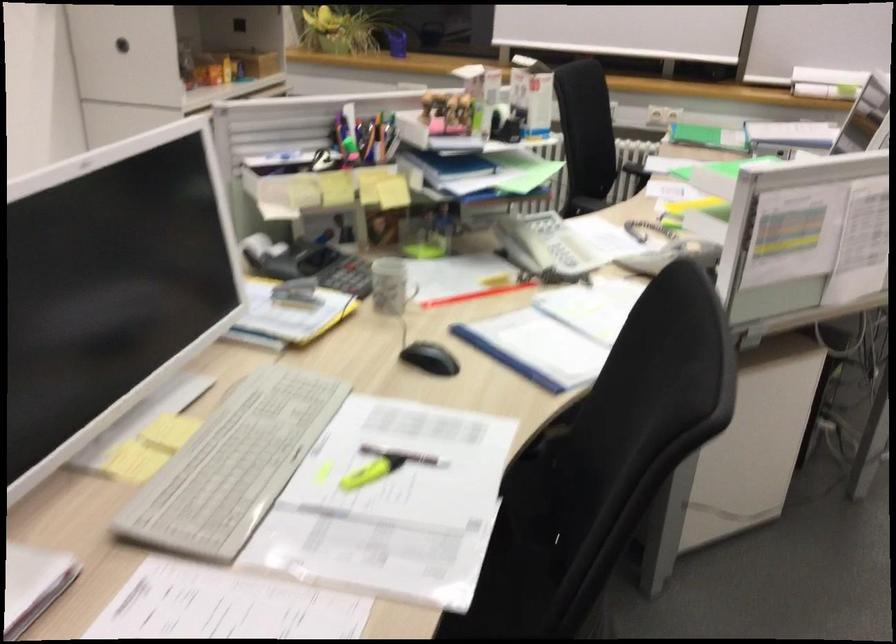
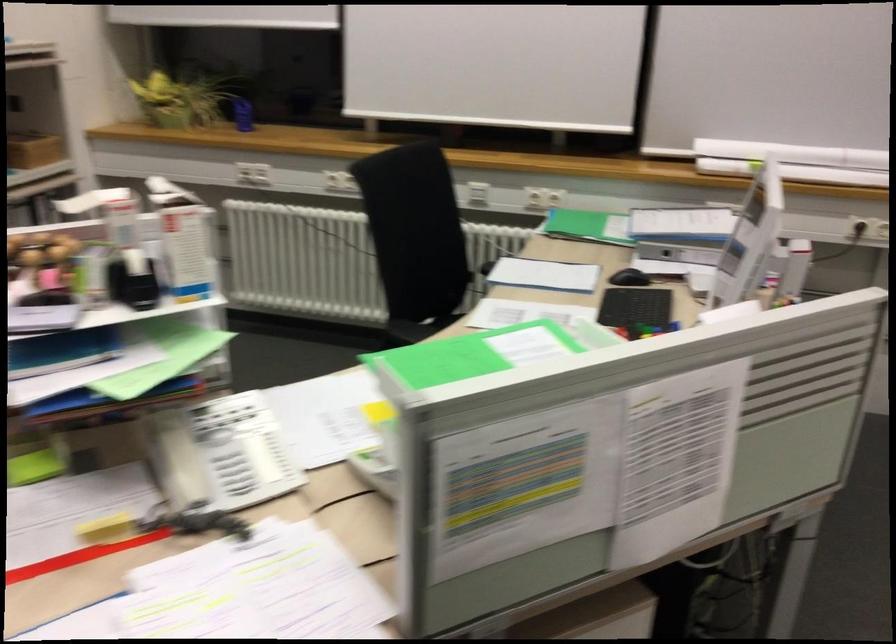
The images are taken continuously from a first-person perspective. In which direction are you moving?

The cameraman moved toward right, forward.